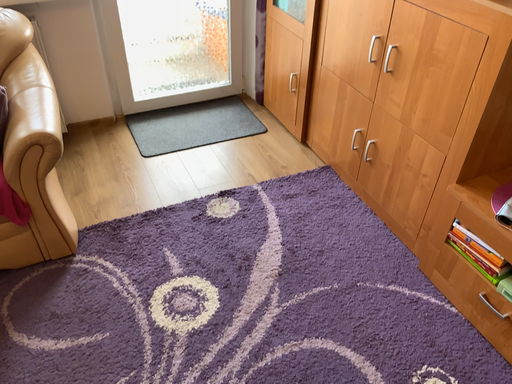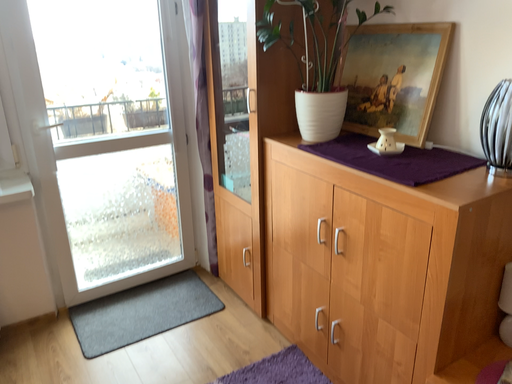
Question: How did the camera likely rotate when shooting the video?

Choices:
 (A) rotated downward
 (B) rotated upward

Answer: (B)